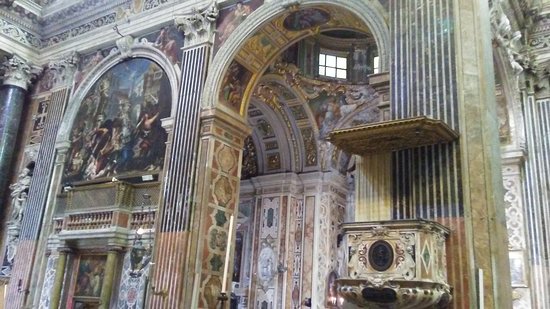
This screenshot has width=550, height=309. I want to click on archway, so click(302, 22).